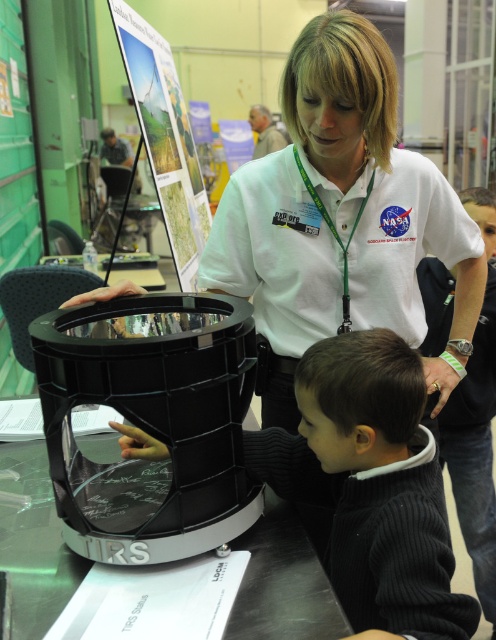
You are standing at the front of the room and want to hand a brochure to both the person wearing the white smooth shirt at center and the person wearing the dark gray ribbed sweater at lower center. Which person should you approach first to ensure you can reach them without moving closer?

You should approach the white smooth shirt at center first because it is closer to you than the dark gray ribbed sweater at lower center, so you can reach them without moving closer.

You are a photographer at the event and need to ensure both the white smooth shirt at center and the dark gray ribbed sweater at lower center are visible in the photo. Given their sizes, which one might require you to adjust your camera angle to capture fully?

The white smooth shirt at center is larger in size than the dark gray ribbed sweater at lower center, so you might need to adjust your camera angle to ensure the larger white smooth shirt at center is fully captured in the photo.